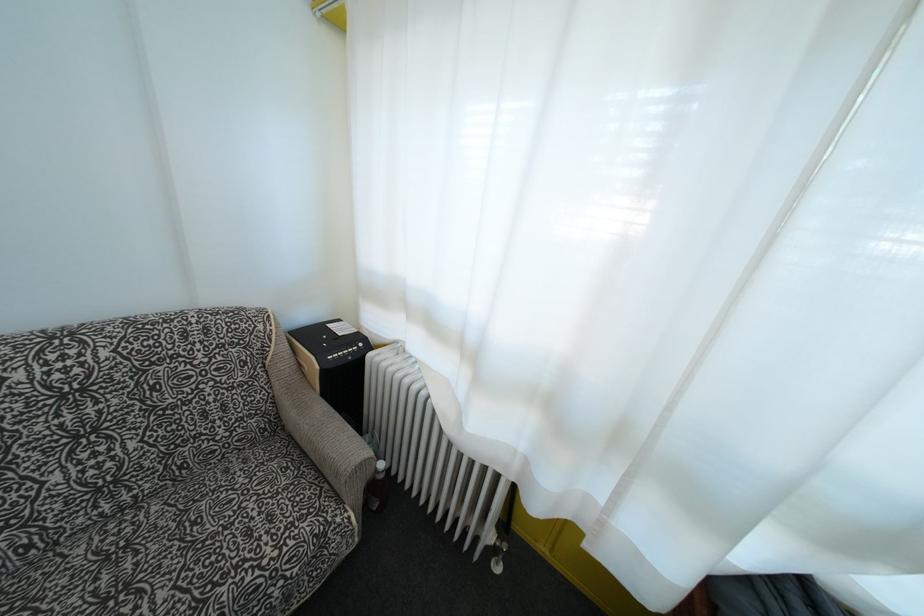
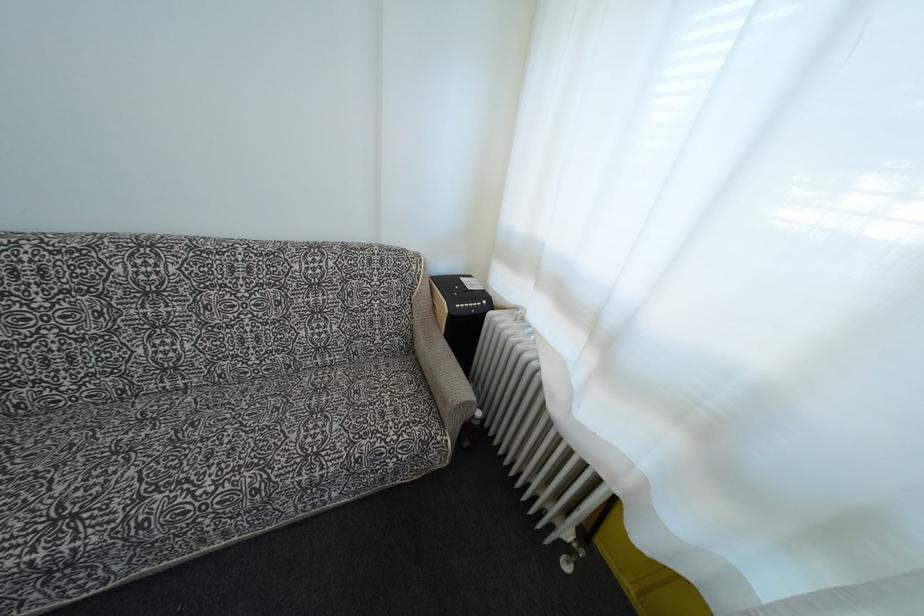
Question: The camera is either moving clockwise (left) or counter-clockwise (right) around the object. The first image is from the beginning of the video and the second image is from the end. Is the camera moving left or right when shooting the video?

Choices:
 (A) Left
 (B) Right

Answer: (B)